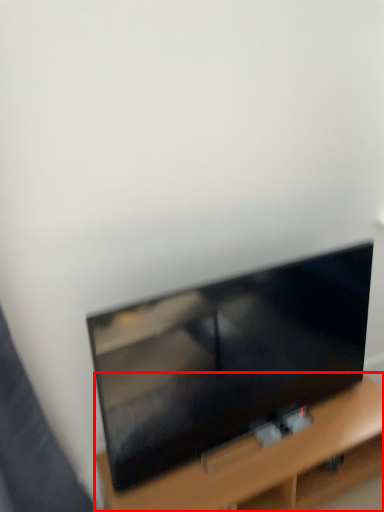
Question: Observing the image, what is the correct spatial positioning of furniture (annotated by the red box) in reference to television?

Choices:
 (A) left
 (B) right

Answer: (B)